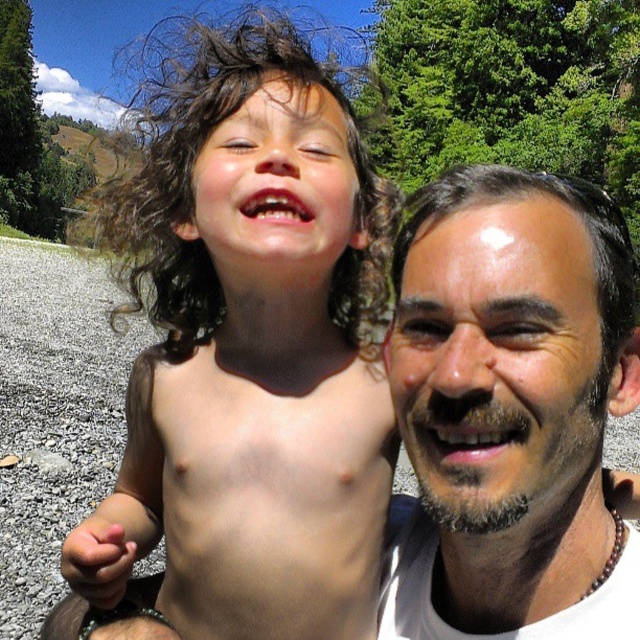
Does smooth skin face at right have a smaller size compared to skinsmoothtorso at center?

Incorrect, smooth skin face at right is not smaller in size than skinsmoothtorso at center.

Consider the image. Who is more forward, (428, 612) or (333, 608)?

Positioned in front is point (428, 612).

Locate an element on the screen. This screenshot has height=640, width=640. smooth skin face at right is located at coordinates (509, 410).

Can you confirm if skinsmoothtorso at center is positioned below smooth skin face at upper right?

Indeed, skinsmoothtorso at center is positioned under smooth skin face at upper right.

Does point (349, 595) lie behind point (634, 381)?

That is True.

Who is more forward, (355, 611) or (400, 554)?

Point (400, 554) is more forward.

The width and height of the screenshot is (640, 640). What are the coordinates of `skinsmoothtorso at center` in the screenshot? It's located at (269, 490).

Can you confirm if brown curly hair at center is positioned below skinsmoothtorso at center?

No, brown curly hair at center is not below skinsmoothtorso at center.

From the picture: Who is shorter, brown curly hair at center or skinsmoothtorso at center?

skinsmoothtorso at center

Is point (163, 260) positioned in front of point (257, 612)?

No, (163, 260) is behind (257, 612).

Identify the location of brown curly hair at center. (250, 353).